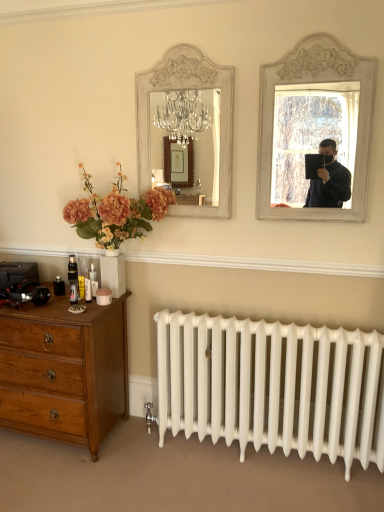
Question: Is white painted wood mirror at upper right inside or outside of white painted wood mirror at upper center?

Choices:
 (A) outside
 (B) inside

Answer: (A)

Question: From a real-world perspective, relative to white painted wood mirror at upper center, is white painted wood mirror at upper right vertically above or below?

Choices:
 (A) below
 (B) above

Answer: (A)

Question: Which is farther from the white painted wood mirror at upper right?

Choices:
 (A) wooden dresser at lower left
 (B) white painted wood mirror at upper center

Answer: (A)

Question: Considering the real-world distances, which object is closest to the wooden dresser at lower left?

Choices:
 (A) white painted wood mirror at upper right
 (B) white painted wood mirror at upper center

Answer: (B)